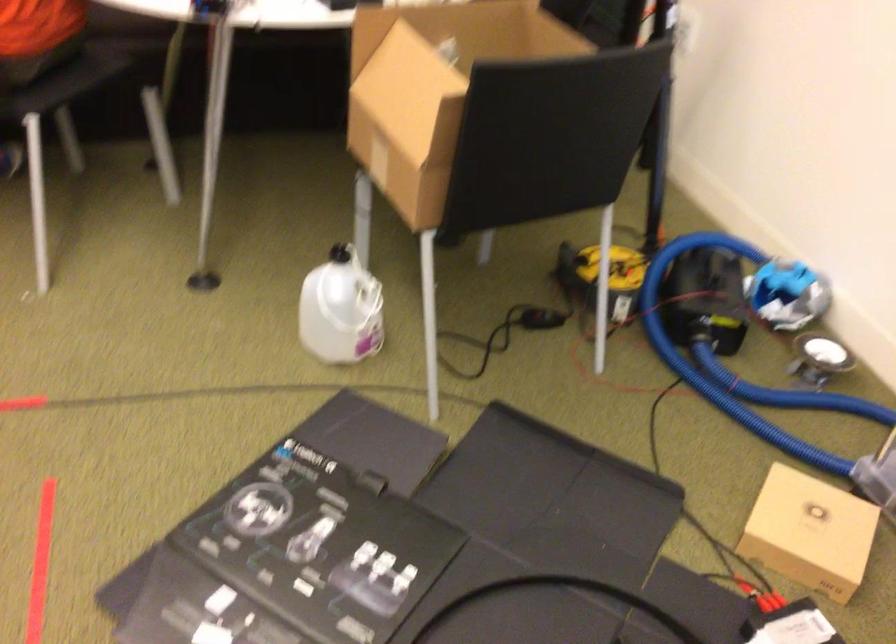
What do you see at coordinates (30, 82) in the screenshot?
I see `the chair sitting surface` at bounding box center [30, 82].